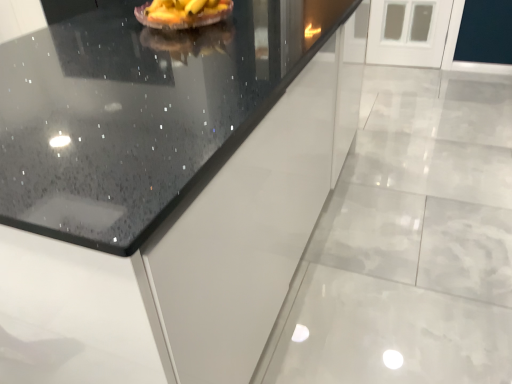
Question: Is black granite countertop at center at the left side of yellow matte cake at upper center?

Choices:
 (A) yes
 (B) no

Answer: (B)

Question: Is black granite countertop at center to the right of yellow matte cake at upper center from the viewer's perspective?

Choices:
 (A) no
 (B) yes

Answer: (B)

Question: Can you confirm if black granite countertop at center is shorter than yellow matte cake at upper center?

Choices:
 (A) yes
 (B) no

Answer: (B)

Question: From the image's perspective, is black granite countertop at center under yellow matte cake at upper center?

Choices:
 (A) yes
 (B) no

Answer: (A)

Question: Is black granite countertop at center not inside yellow matte cake at upper center?

Choices:
 (A) yes
 (B) no

Answer: (A)

Question: From a real-world perspective, is black granite countertop at center physically above yellow matte cake at upper center?

Choices:
 (A) no
 (B) yes

Answer: (A)

Question: Considering the relative sizes of yellow matte cake at upper center and black granite countertop at center in the image provided, is yellow matte cake at upper center wider than black granite countertop at center?

Choices:
 (A) no
 (B) yes

Answer: (A)

Question: Does yellow matte cake at upper center have a smaller size compared to black granite countertop at center?

Choices:
 (A) no
 (B) yes

Answer: (B)

Question: Can you confirm if yellow matte cake at upper center is thinner than black granite countertop at center?

Choices:
 (A) yes
 (B) no

Answer: (A)

Question: Considering the relative positions of yellow matte cake at upper center and black granite countertop at center in the image provided, is yellow matte cake at upper center to the right of black granite countertop at center from the viewer's perspective?

Choices:
 (A) yes
 (B) no

Answer: (B)

Question: Is the position of yellow matte cake at upper center more distant than that of black granite countertop at center?

Choices:
 (A) yes
 (B) no

Answer: (A)

Question: Considering the relative sizes of yellow matte cake at upper center and black granite countertop at center in the image provided, is yellow matte cake at upper center bigger than black granite countertop at center?

Choices:
 (A) no
 (B) yes

Answer: (A)

Question: From a real-world perspective, is yellow matte cake at upper center above or below black granite countertop at center?

Choices:
 (A) above
 (B) below

Answer: (A)